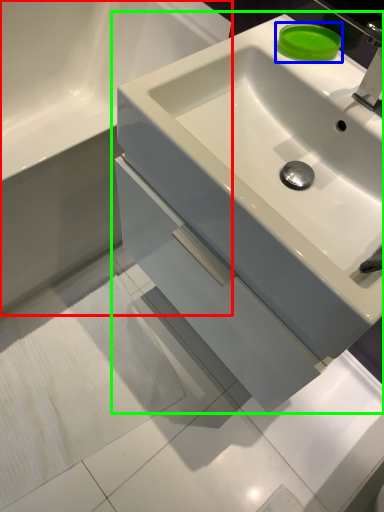
Question: Considering the real-world distances, which object is farthest from bathroom cabinet (highlighted by a red box)? soap (highlighted by a blue box) or sink (highlighted by a green box)?

Choices:
 (A) soap
 (B) sink

Answer: (A)